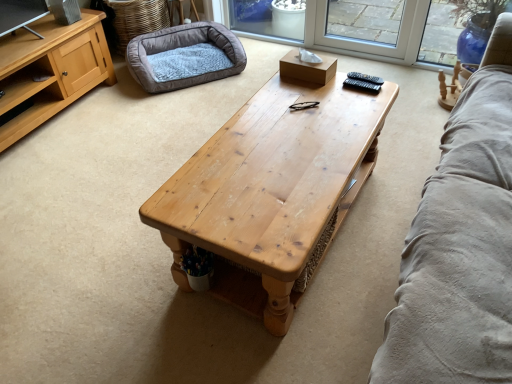
Where is `vacant space to the right of wooden coffee table at center`? This screenshot has height=384, width=512. vacant space to the right of wooden coffee table at center is located at coordinates (393, 193).